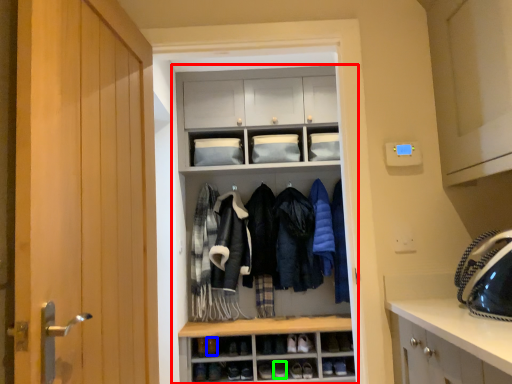
Question: Which object is positioned closest to cupboard (highlighted by a red box)? Select from shoe (highlighted by a blue box) and shoe (highlighted by a green box).

Choices:
 (A) shoe
 (B) shoe

Answer: (A)